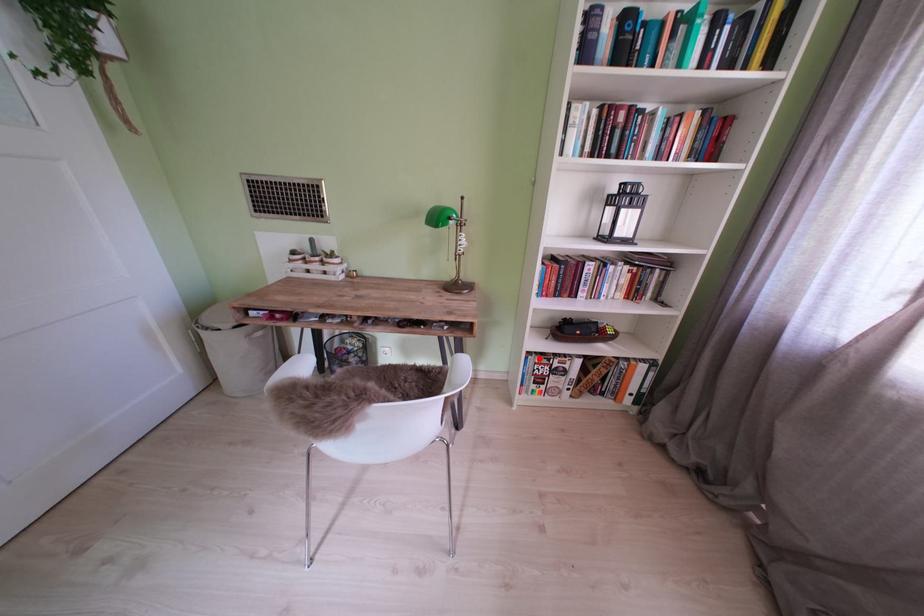
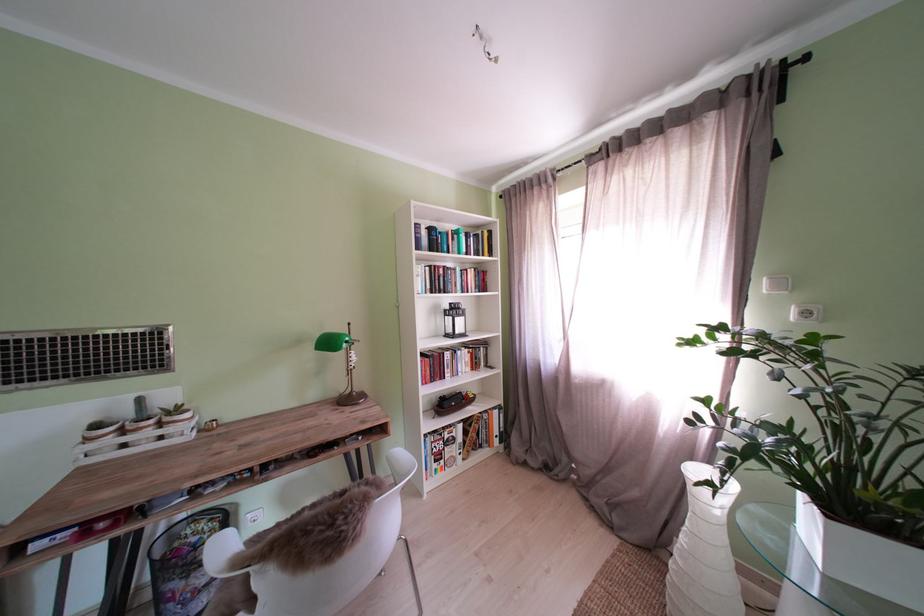
Question: A red point is marked in image1. In image2, is the corresponding 3D point closer to the camera or farther? Reply with the corresponding letter.

Choices:
 (A) The corresponding 3D point is closer.
 (B) The corresponding 3D point is farther.

Answer: (B)